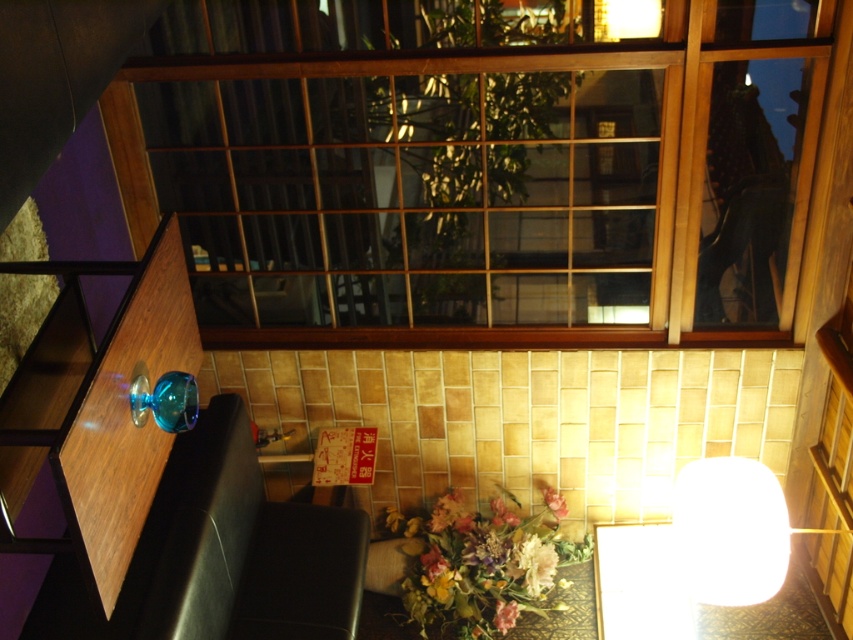
Is white glossy lampshade at lower right to the left of pink matte flower at lower center from the viewer's perspective?

In fact, white glossy lampshade at lower right is to the right of pink matte flower at lower center.

Is white glossy lampshade at lower right bigger than pink matte flower at lower center?

Correct, white glossy lampshade at lower right is larger in size than pink matte flower at lower center.

Which is in front, point (730, 509) or point (544, 492)?

Positioned in front is point (730, 509).

This screenshot has width=853, height=640. I want to click on white glossy lampshade at lower right, so click(730, 531).

Is white glossy lampshade at lower right taller than transparent glass lamp at lower left?

Correct, white glossy lampshade at lower right is much taller as transparent glass lamp at lower left.

Is point (723, 580) farther from camera compared to point (140, 397)?

Yes, point (723, 580) is farther from viewer.

Where is `white glossy lampshade at lower right`? The width and height of the screenshot is (853, 640). white glossy lampshade at lower right is located at coordinates [730, 531].

Locate an element on the screen. The image size is (853, 640). white glossy lampshade at lower right is located at coordinates (730, 531).

Is transparent glass lamp at lower left in front of pink matte flower at lower center?

Yes, it is in front of pink matte flower at lower center.

Can you confirm if transparent glass lamp at lower left is taller than pink matte flower at lower center?

Indeed, transparent glass lamp at lower left has a greater height compared to pink matte flower at lower center.

Between point (196, 392) and point (561, 515), which one is positioned in front?

Point (196, 392) is more forward.

At what (x,y) coordinates should I click in order to perform the action: click on transparent glass lamp at lower left. Please return your answer as a coordinate pair (x, y). Image resolution: width=853 pixels, height=640 pixels. Looking at the image, I should click on (165, 401).